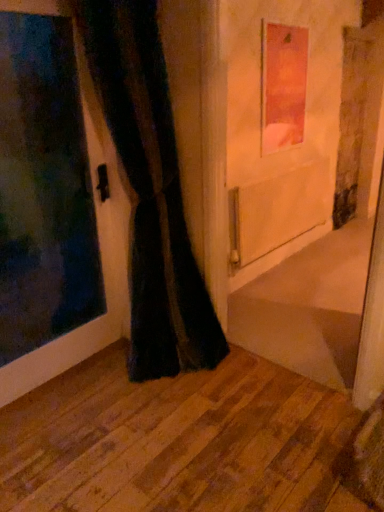
Question: From a real-world perspective, is matte pink picture frame at upper center positioned above or below wooden floor at lower left?

Choices:
 (A) below
 (B) above

Answer: (B)

Question: Is matte pink picture frame at upper center wider or thinner than wooden floor at lower left?

Choices:
 (A) thin
 (B) wide

Answer: (A)

Question: Does point (286, 56) appear closer or farther from the camera than point (238, 445)?

Choices:
 (A) closer
 (B) farther

Answer: (B)

Question: From a real-world perspective, is wooden floor at lower left positioned above or below matte pink picture frame at upper center?

Choices:
 (A) below
 (B) above

Answer: (A)

Question: From the image's perspective, is wooden floor at lower left above or below matte pink picture frame at upper center?

Choices:
 (A) above
 (B) below

Answer: (B)

Question: Is wooden floor at lower left inside the boundaries of matte pink picture frame at upper center, or outside?

Choices:
 (A) inside
 (B) outside

Answer: (B)

Question: In the image, is wooden floor at lower left on the left side or the right side of matte pink picture frame at upper center?

Choices:
 (A) left
 (B) right

Answer: (A)